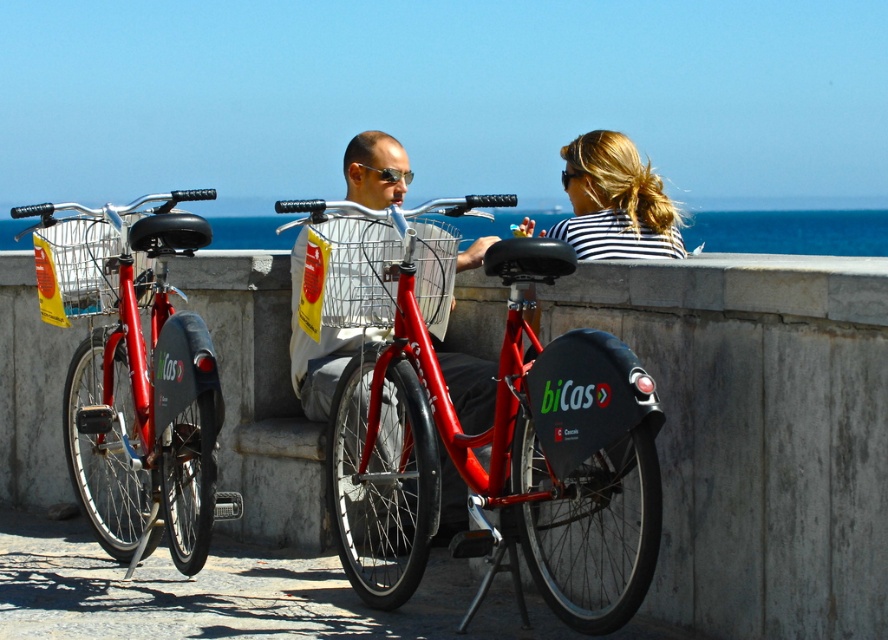
Question: From the image, what is the correct spatial relationship of shiny red bicycle at center in relation to striped fabric hair at center?

Choices:
 (A) above
 (B) below

Answer: (B)

Question: Which object is positioned closest to the matte red bicycle at left?

Choices:
 (A) shiny red bicycle at center
 (B) striped fabric hair at center
 (C) shiny metallic bicycle at center

Answer: (A)

Question: Which of the following is the closest to the observer?

Choices:
 (A) matte red bicycle at left
 (B) shiny metallic bicycle at center
 (C) shiny red bicycle at center

Answer: (C)

Question: Is shiny red bicycle at center positioned in front of matte red bicycle at left?

Choices:
 (A) yes
 (B) no

Answer: (A)

Question: Does striped fabric hair at center appear under shiny metallic bicycle at center?

Choices:
 (A) yes
 (B) no

Answer: (A)

Question: Which of these objects is positioned farthest from the striped fabric hair at center?

Choices:
 (A) shiny red bicycle at center
 (B) matte red bicycle at left
 (C) shiny metallic bicycle at center

Answer: (B)